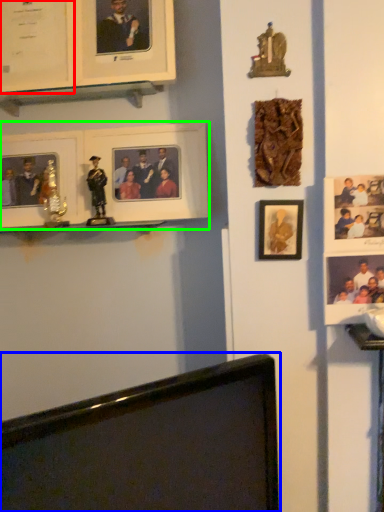
Question: Which object is the closest to the picture frame (highlighted by a red box)? Choose among these: computer monitor (highlighted by a blue box) or picture frame (highlighted by a green box).

Choices:
 (A) computer monitor
 (B) picture frame

Answer: (B)